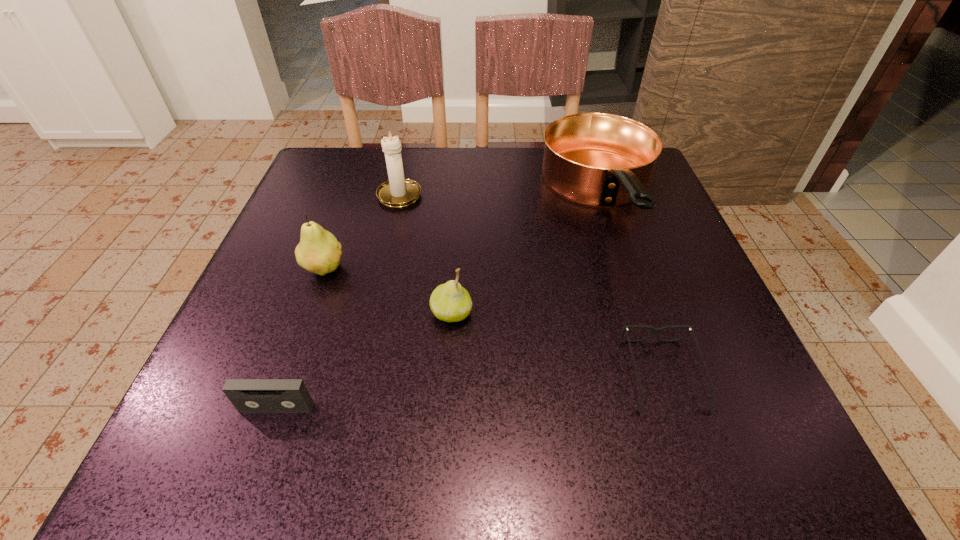
I want to click on free space at the far left corner of the desktop, so click(337, 181).

The height and width of the screenshot is (540, 960). I want to click on vacant space at the near left corner of the desktop, so click(x=248, y=469).

In the image, there is a desktop. Identify the location of free space at the near right corner. The width and height of the screenshot is (960, 540). (734, 474).

This screenshot has width=960, height=540. I want to click on vacant area that lies between the candle holder and the fourth farthest object, so click(x=426, y=253).

Find the location of a particular element. This screenshot has width=960, height=540. free point between the nearer pear and the left pear is located at coordinates (388, 292).

Locate an element on the screen. The height and width of the screenshot is (540, 960). free space between the left pear and the spectacles is located at coordinates (493, 322).

Find the location of a particular element. The image size is (960, 540). empty space between the farther pear and the videotape is located at coordinates [300, 339].

The image size is (960, 540). Identify the location of free point between the left pear and the frying pan. (464, 235).

Identify the location of free space that is in between the frying pan and the candle holder. (501, 197).

The width and height of the screenshot is (960, 540). I want to click on free space between the candle holder and the farther pear, so click(362, 231).